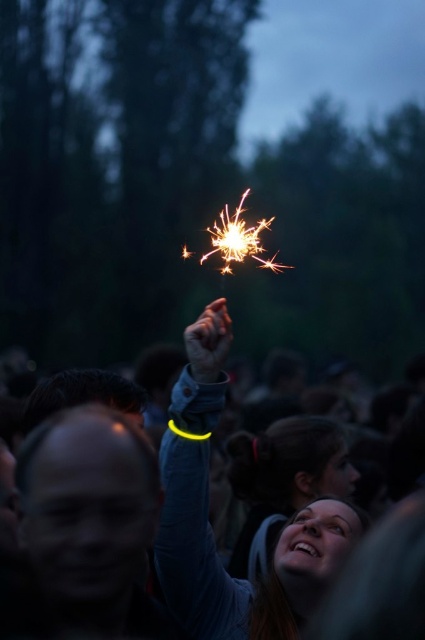
Who is positioned more to the left, yellow glow-in-the-dark wristband at upper center or smooth skin face at upper center?

yellow glow-in-the-dark wristband at upper center

Which is more to the right, yellow glow-in-the-dark wristband at upper center or smooth skin face at upper center?

Positioned to the right is smooth skin face at upper center.

Does point (223, 609) lie behind point (323, 508)?

Yes, it is.

The height and width of the screenshot is (640, 425). I want to click on yellow glow-in-the-dark wristband at upper center, so click(x=207, y=518).